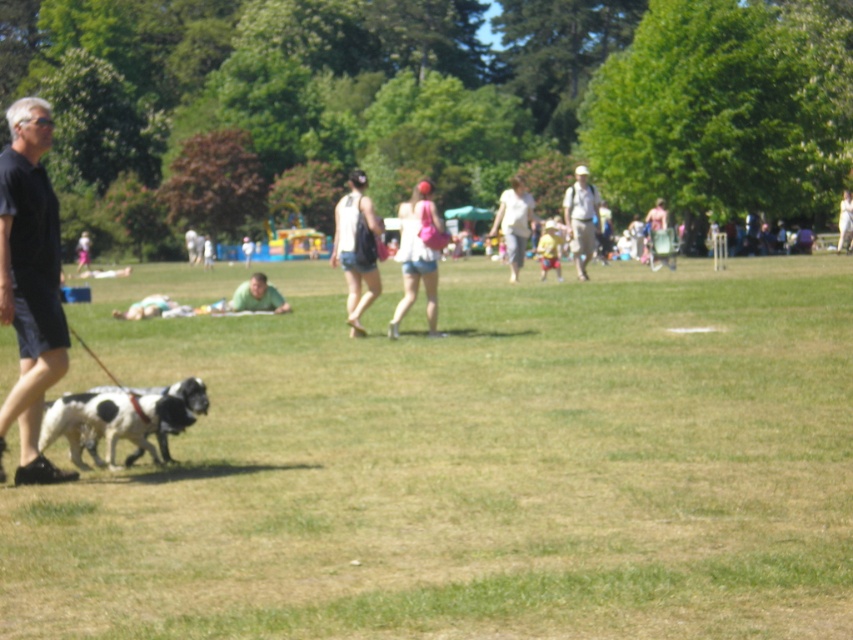
Question: Among these objects, which one is farthest from the camera?

Choices:
 (A) green matte shirt at center
 (B) green grass at lower left
 (C) white cotton shirt at center
 (D) black and white fur dog at lower left

Answer: (C)

Question: Can you confirm if matte black tank top at center is positioned to the left of green matte shirt at center?

Choices:
 (A) yes
 (B) no

Answer: (B)

Question: Does dark gray shirt at left have a larger size compared to green matte shirt at center?

Choices:
 (A) yes
 (B) no

Answer: (A)

Question: Which object appears closest to the camera in this image?

Choices:
 (A) black and white fur dog at lower left
 (B) pink fabric purse at center
 (C) green grass at lower left

Answer: (C)

Question: Among these points, which one is farthest from the camera?

Choices:
 (A) (234, 301)
 (B) (45, 426)
 (C) (374, 220)
 (D) (428, 276)

Answer: (A)

Question: Where is pink fabric purse at center located in relation to white cotton shirt at center in the image?

Choices:
 (A) above
 (B) below

Answer: (B)